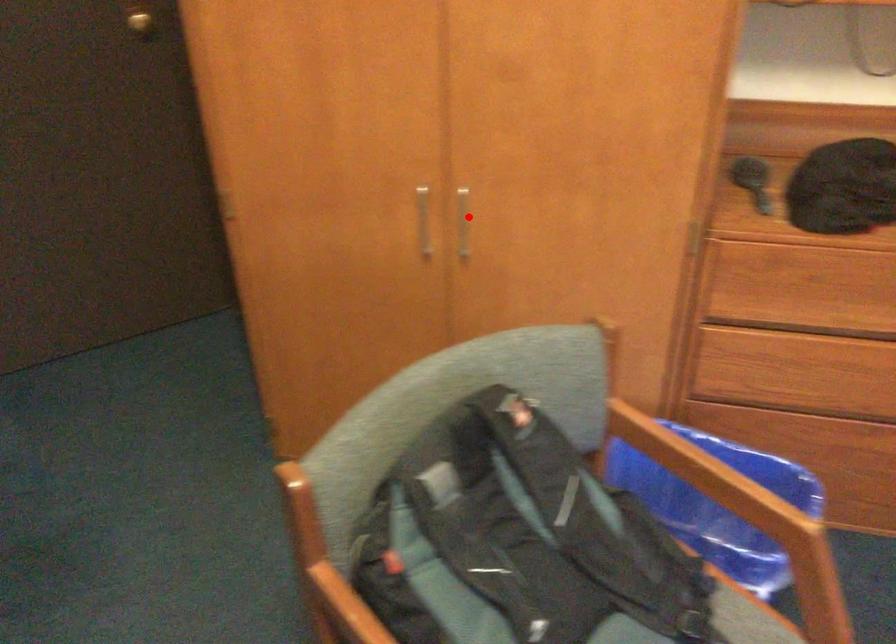
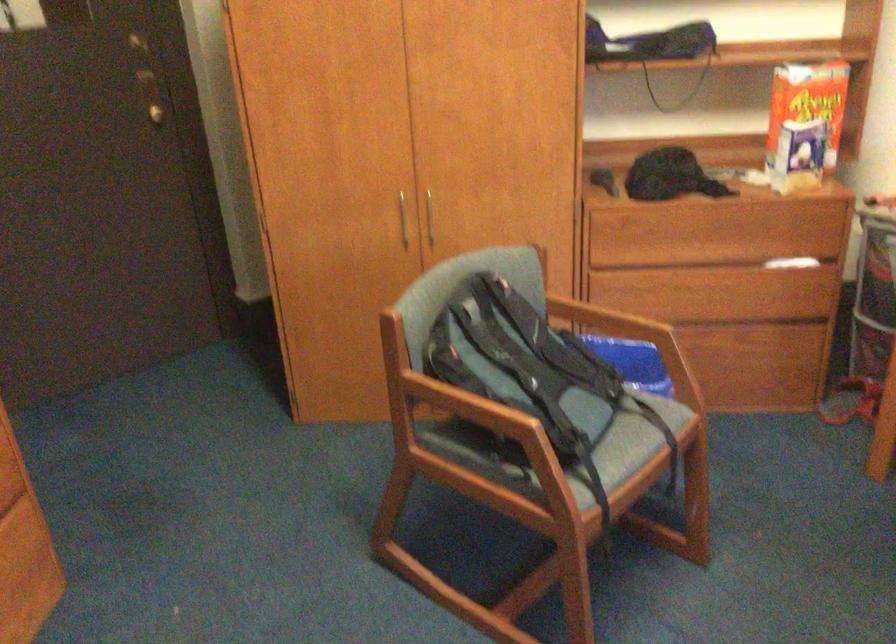
Question: I am providing you with two images of the same scene from different viewpoints. In image1, a red point is highlighted. Considering the same 3D point in image2, which of the following is correct?

Choices:
 (A) It is closer
 (B) It is farther

Answer: (B)